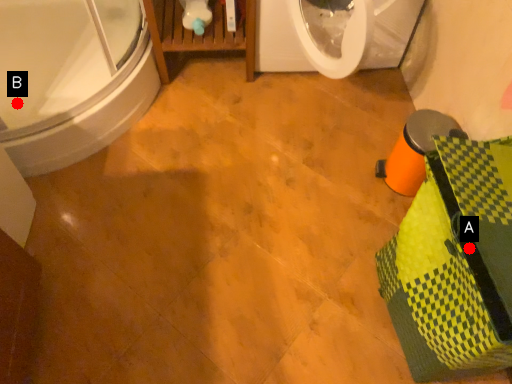
Question: Two points are circled on the image, labeled by A and B beside each circle. Which point is closer to the camera?

Choices:
 (A) A is closer
 (B) B is closer

Answer: (A)